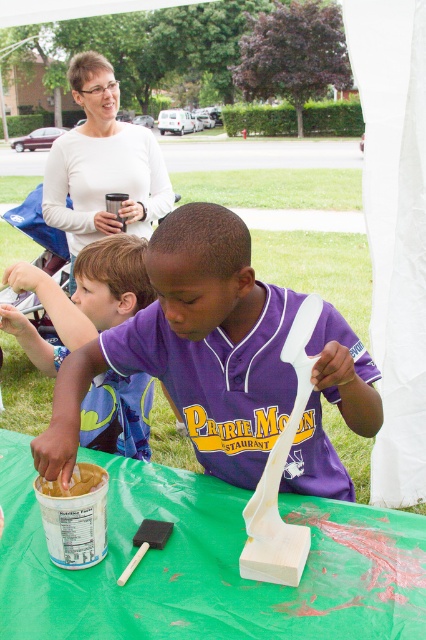
Does green fabric table at center have a larger size compared to smooth beige paste at lower left?

Correct, green fabric table at center is larger in size than smooth beige paste at lower left.

Does point (109, 531) come closer to viewer compared to point (52, 493)?

No, (109, 531) is further to viewer.

Where is `green fabric table at center`? The height and width of the screenshot is (640, 426). green fabric table at center is located at coordinates (204, 564).

This screenshot has height=640, width=426. Identify the location of green fabric table at center. (204, 564).

Consider the image. Does green fabric table at center appear on the right side of purple jersey at center?

In fact, green fabric table at center is to the left of purple jersey at center.

From the picture: Can you confirm if green fabric table at center is smaller than purple jersey at center?

Yes.

Find the location of `green fabric table at center`. green fabric table at center is located at coordinates (204, 564).

Locate an element on the screen. This screenshot has height=640, width=426. green fabric table at center is located at coordinates (x=204, y=564).

Can you confirm if purple jersey at center is positioned to the right of matte purple jersey at center?

Yes, purple jersey at center is to the right of matte purple jersey at center.

Based on the photo, is purple jersey at center positioned in front of matte purple jersey at center?

Yes, purple jersey at center is in front of matte purple jersey at center.

Between point (244, 275) and point (141, 385), which one is positioned behind?

The point (141, 385) is more distant.

Identify the location of purple jersey at center. (193, 349).